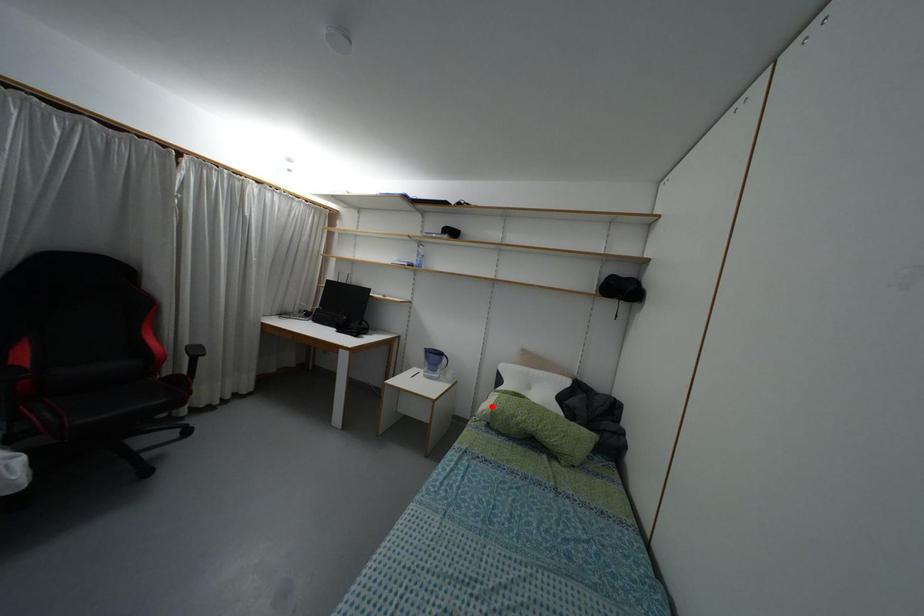
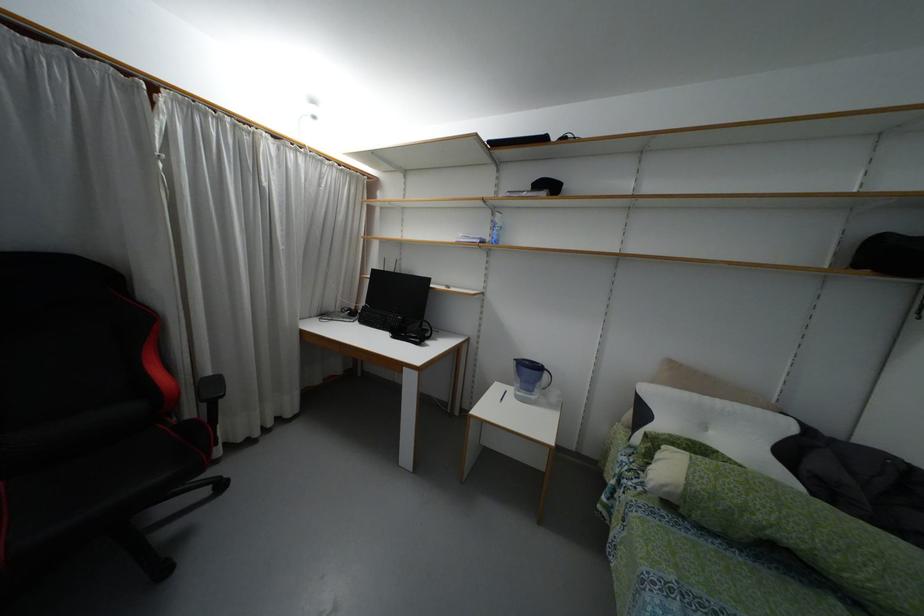
In the second image, find the point that corresponds to the highlighted location in the first image.

(687, 483)